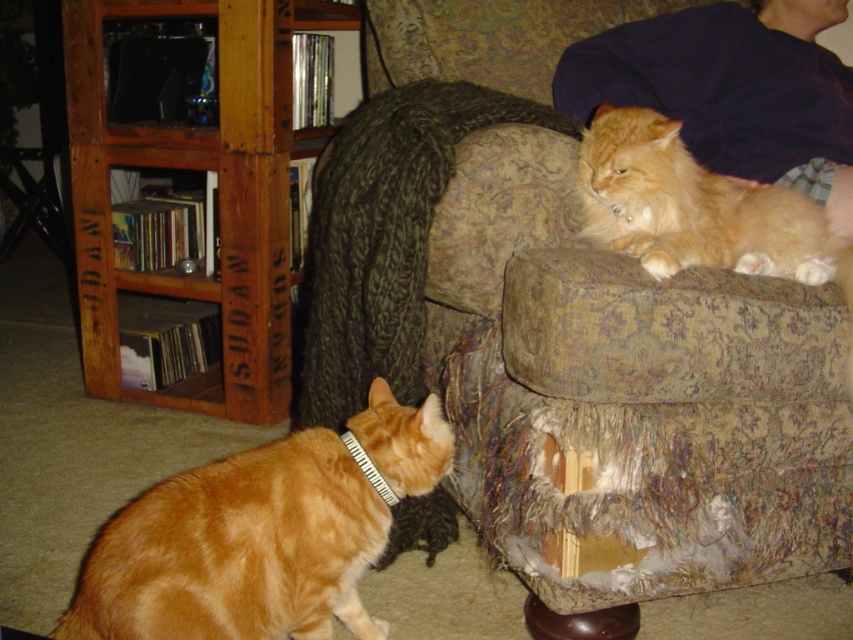
Does orange fur cat at upper right have a greater height compared to black fabric neckband at lower left?

Yes.

Where is `orange fur cat at upper right`? orange fur cat at upper right is located at coordinates (695, 208).

Is patterned fabric couch at upper center to the left of black fabric neckband at lower left from the viewer's perspective?

No, patterned fabric couch at upper center is not to the left of black fabric neckband at lower left.

Is patterned fabric couch at upper center positioned behind black fabric neckband at lower left?

No.

Which is in front, point (746, 317) or point (374, 484)?

Positioned in front is point (746, 317).

The image size is (853, 640). What are the coordinates of `patterned fabric couch at upper center` in the screenshot? It's located at (485, 36).

You are a GUI agent. You are given a task and a screenshot of the screen. Output one action in this format:
    pyautogui.click(x=<x>, y=<y>)
    Task: Click on the orange fur cat at lower left
    The width and height of the screenshot is (853, 640).
    Given the screenshot: What is the action you would take?
    pyautogui.click(x=238, y=550)

How distant is orange fur cat at lower left from orange fur cat at upper right?

orange fur cat at lower left is 18.58 inches away from orange fur cat at upper right.

The width and height of the screenshot is (853, 640). In order to click on orange fur cat at lower left in this screenshot , I will do `click(238, 550)`.

Find the location of a particular element. The height and width of the screenshot is (640, 853). orange fur cat at lower left is located at coordinates (238, 550).